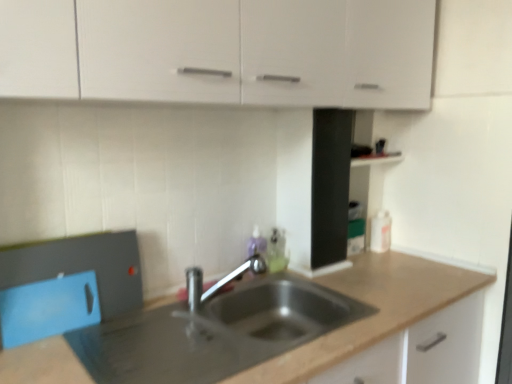
Question: In the image, is polished chrome tap at center on the left side or the right side of metallic gray countertop at center?

Choices:
 (A) left
 (B) right

Answer: (A)

Question: Considering the positions of polished chrome tap at center and metallic gray countertop at center in the image, is polished chrome tap at center taller or shorter than metallic gray countertop at center?

Choices:
 (A) tall
 (B) short

Answer: (B)

Question: Which is farther from the white matte cabinet at upper center?

Choices:
 (A) polished chrome tap at center
 (B) metallic gray countertop at center

Answer: (B)

Question: Which of these objects is positioned farthest from the polished chrome tap at center?

Choices:
 (A) white matte cabinet at upper center
 (B) metallic gray countertop at center

Answer: (A)